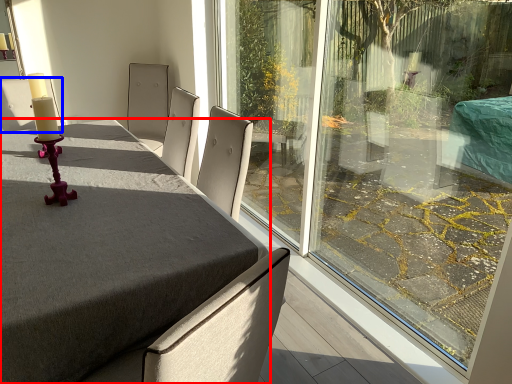
Question: Which point is further to the camera, table (highlighted by a red box) or chair (highlighted by a blue box)?

Choices:
 (A) table
 (B) chair

Answer: (B)